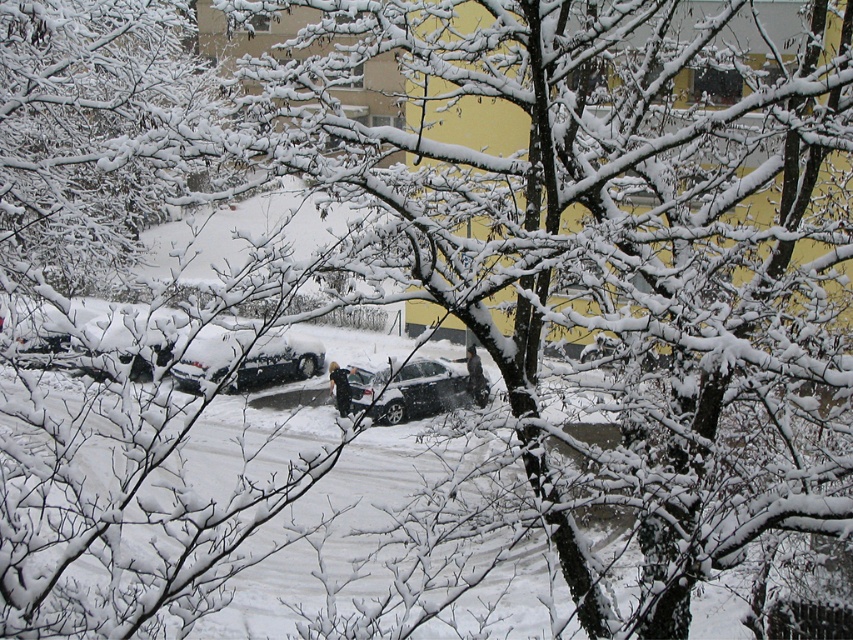
Question: Is sleek black car at center further to camera compared to satin silver sedan at center?

Choices:
 (A) no
 (B) yes

Answer: (B)

Question: Among these objects, which one is farthest from the camera?

Choices:
 (A) sleek black car at center
 (B) satin silver sedan at center

Answer: (A)

Question: Which point is closer to the camera?

Choices:
 (A) satin silver sedan at center
 (B) sleek black car at center

Answer: (A)

Question: Can you confirm if sleek black car at center is thinner than satin silver sedan at center?

Choices:
 (A) yes
 (B) no

Answer: (B)

Question: Does sleek black car at center lie behind satin silver sedan at center?

Choices:
 (A) no
 (B) yes

Answer: (B)

Question: Among these points, which one is farthest from the camera?

Choices:
 (A) (306, 364)
 (B) (440, 404)

Answer: (A)